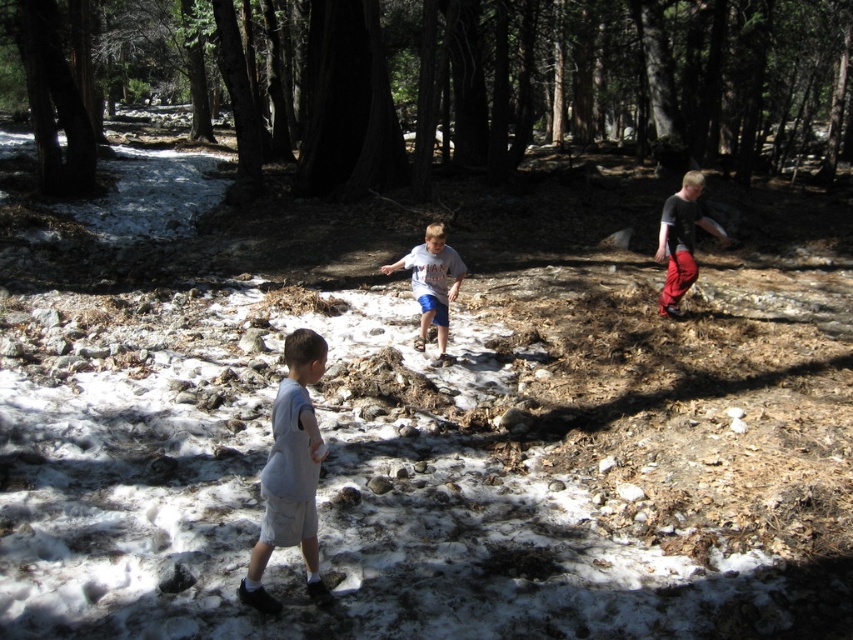
You are a parent looking for your children in the forest. You see two shirts hanging from a tree branch. Which shirt is closer to the center of the scene, the dark gray shirt at right or the gray cotton shirt at center?

The gray cotton shirt at center is closer to the center of the scene because the dark gray shirt at right is positioned to the right of it.

You are one of the children in the forest scene. You want to move from your current position to the gray cotton shirt at center. Which direction should you move relative to the brown rough tree at upper center?

Since the brown rough tree at upper center is to the left of the gray cotton shirt at center, you should move to the right relative to the brown rough tree at upper center to reach the gray cotton shirt at center.

You are a photographer trying to capture a photo of two points in the forest scene. The first point is at coordinates point (352, 147) and the second is at point (425, 291). Based on their positions, which point is closer to the camera?

Point (352, 147) is further to the camera than point (425, 291), so the point closer to the camera is point (425, 291).